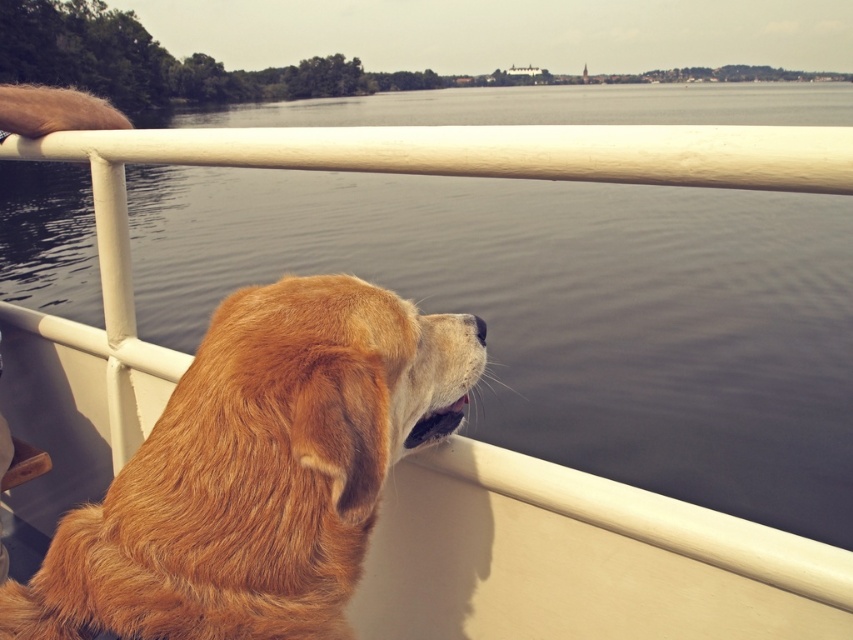
Which of these two, smooth water at center or golden fur dog at left, stands taller?

smooth water at center

This screenshot has width=853, height=640. Find the location of `smooth water at center`. smooth water at center is located at coordinates (567, 312).